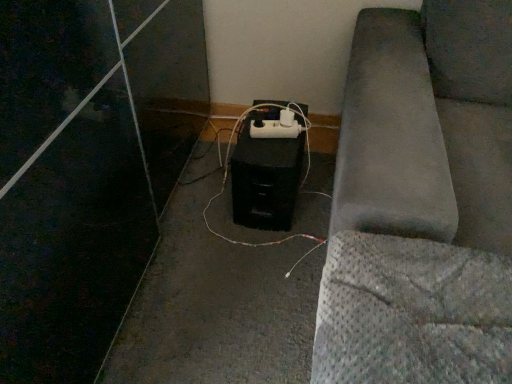
Find the location of `free space above black plastic computer tower at center (from a real-world perspective)`. free space above black plastic computer tower at center (from a real-world perspective) is located at coordinates (272, 130).